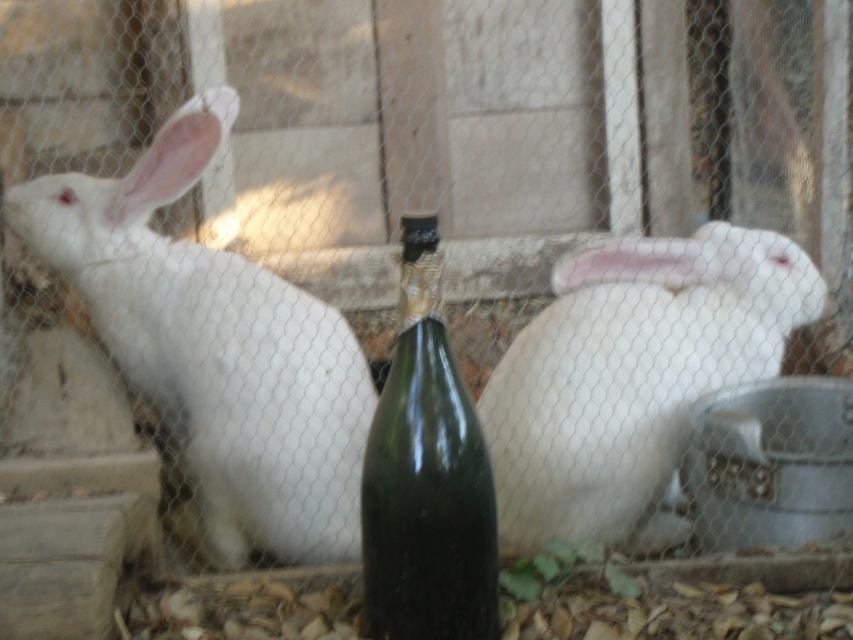
Can you confirm if white matte fur at left is shorter than white matte fur at center?

No.

Is white matte fur at left bigger than white matte fur at center?

Indeed, white matte fur at left has a larger size compared to white matte fur at center.

Which is behind, point (338, 380) or point (604, 326)?

The point (338, 380) is behind.

Locate an element on the screen. white matte fur at left is located at coordinates (215, 348).

Is white matte fur at left in front of green glass bottle at center?

No, white matte fur at left is behind green glass bottle at center.

Is white matte fur at left further to the viewer compared to green glass bottle at center?

Yes, white matte fur at left is further from the viewer.

Describe the element at coordinates (215, 348) in the screenshot. I see `white matte fur at left` at that location.

Where is `white matte fur at left`? white matte fur at left is located at coordinates (215, 348).

Can you confirm if white matte fur at center is positioned to the right of green glass bottle at center?

Indeed, white matte fur at center is positioned on the right side of green glass bottle at center.

Is white matte fur at center shorter than green glass bottle at center?

Yes.

Describe the element at coordinates (631, 376) in the screenshot. I see `white matte fur at center` at that location.

Locate an element on the screen. This screenshot has height=640, width=853. white matte fur at center is located at coordinates (631, 376).